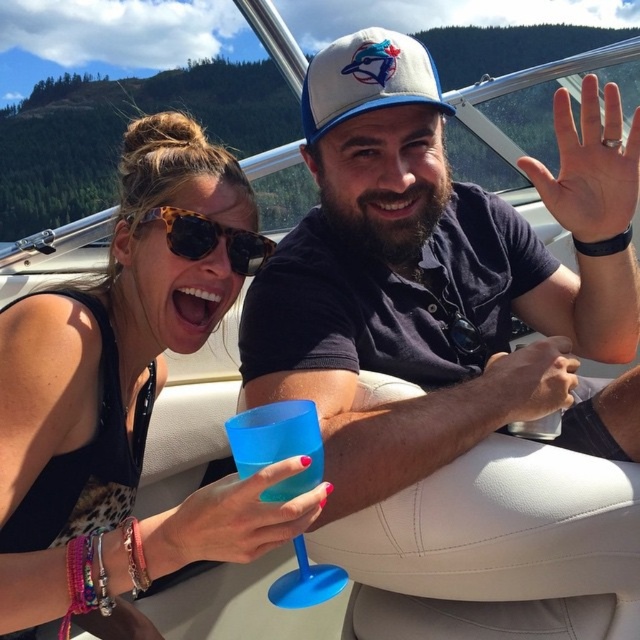
Measure the distance between white fabric baseball cap at center and camera.

1.57 meters

Can you confirm if white fabric baseball cap at center is taller than tortoiseshell plastic sunglasses at upper center?

Indeed, white fabric baseball cap at center has a greater height compared to tortoiseshell plastic sunglasses at upper center.

Which is in front, point (362, 112) or point (205, 248)?

Point (362, 112) is in front.

You are a GUI agent. You are given a task and a screenshot of the screen. Output one action in this format:
    pyautogui.click(x=<x>, y=<y>)
    Task: Click on the white fabric baseball cap at center
    
    Given the screenshot: What is the action you would take?
    pyautogui.click(x=365, y=80)

Which of these two, matte plastic cup at lower center or tortoiseshell plastic sunglasses at upper center, stands taller?

With more height is matte plastic cup at lower center.

Where is `matte plastic cup at lower center`? matte plastic cup at lower center is located at coordinates (236, 518).

Where is `matte plastic cup at lower center`? This screenshot has width=640, height=640. matte plastic cup at lower center is located at coordinates (236, 518).

Measure the distance between matte plastic cup at lower center and camera.

matte plastic cup at lower center and camera are 37.44 inches apart from each other.

Who is more distant from viewer, (x=289, y=508) or (x=339, y=49)?

Point (x=339, y=49)

You are a GUI agent. You are given a task and a screenshot of the screen. Output one action in this format:
    pyautogui.click(x=<x>, y=<y>)
    Task: Click on the matte plastic cup at lower center
    The width and height of the screenshot is (640, 640).
    Given the screenshot: What is the action you would take?
    pos(236,518)